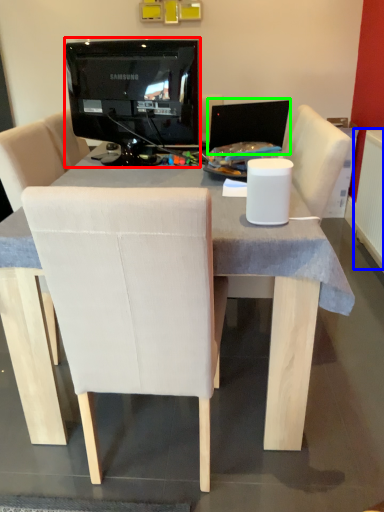
Question: Estimate the real-world distances between objects in this image. Which object is farther from television (highlighted by a red box), radiator (highlighted by a blue box) or computer monitor (highlighted by a green box)?

Choices:
 (A) radiator
 (B) computer monitor

Answer: (A)